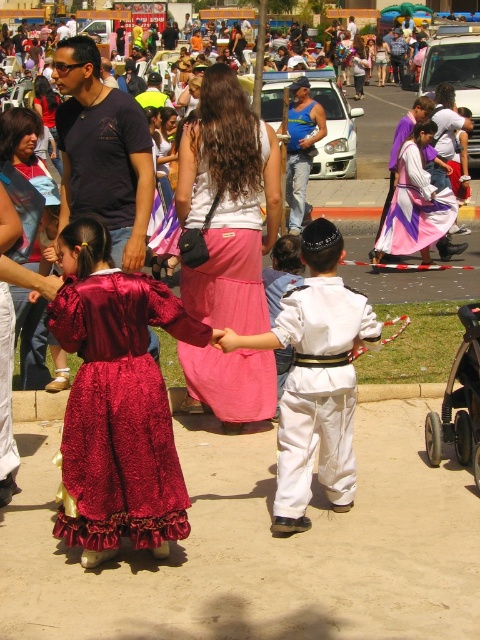
Question: Can you confirm if velvet burgundy dress at lower left is positioned to the right of white cotton outfit at center?

Choices:
 (A) yes
 (B) no

Answer: (B)

Question: Which of these objects is positioned farthest from the pink satin skirt at center?

Choices:
 (A) black plastic baby carriage at lower right
 (B) white cotton outfit at center
 (C) velvet burgundy dress at lower left

Answer: (C)

Question: Does white cotton outfit at center appear on the left side of pink satin skirt at center?

Choices:
 (A) yes
 (B) no

Answer: (B)

Question: Is velvet burgundy dress at lower left above black plastic baby carriage at lower right?

Choices:
 (A) yes
 (B) no

Answer: (B)

Question: Which of these objects is positioned farthest from the pink satin skirt at center?

Choices:
 (A) velvet burgundy dress at lower left
 (B) black plastic baby carriage at lower right

Answer: (A)

Question: Which point is farther to the camera?

Choices:
 (A) velvet burgundy dress at lower left
 (B) pink satin skirt at center

Answer: (B)